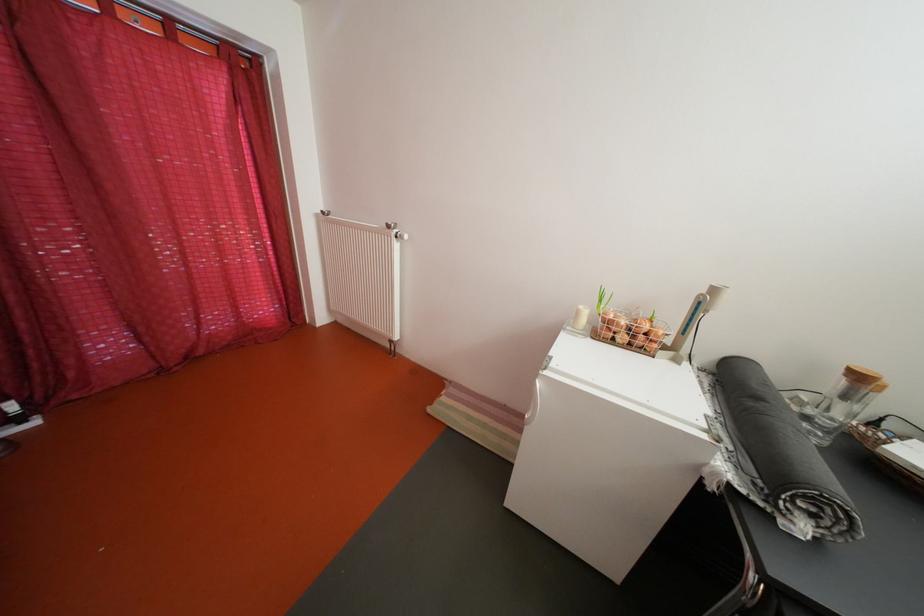
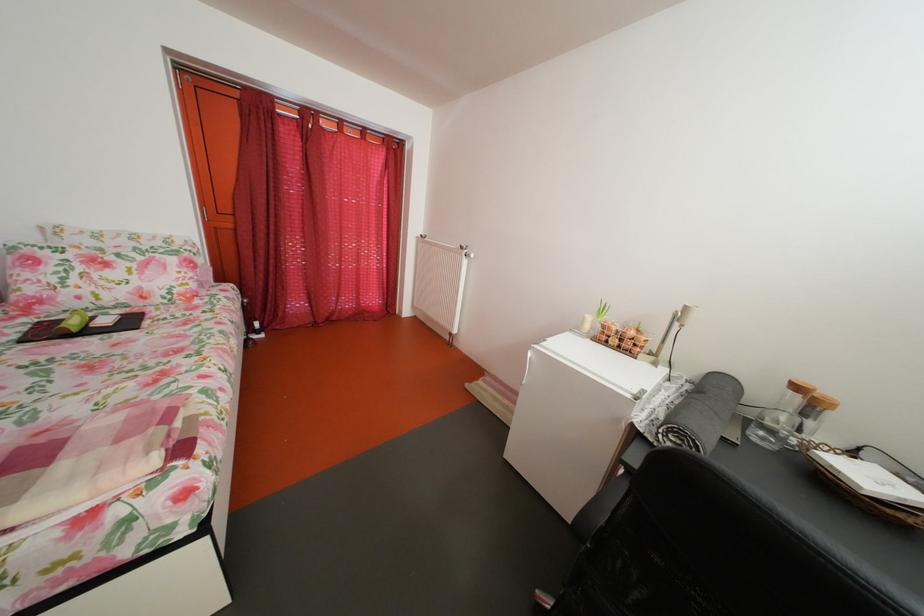
Question: The camera is either moving clockwise (left) or counter-clockwise (right) around the object. The first image is from the beginning of the video and the second image is from the end. Is the camera moving left or right when shooting the video?

Choices:
 (A) Left
 (B) Right

Answer: (B)